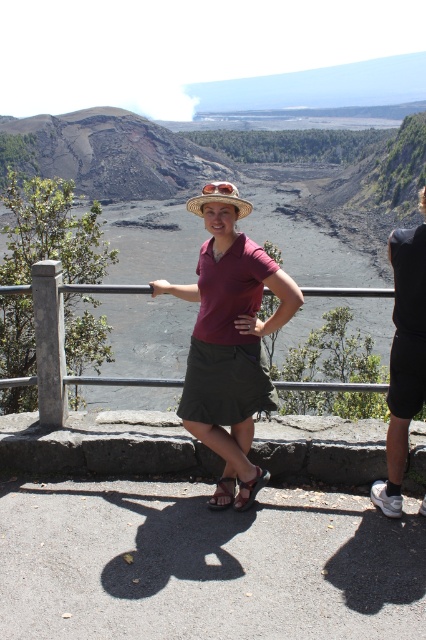
You are a photographer trying to capture both the dark gray shorts at right and the brown leather sandal at lower center in a single shot. Based on their positions, which object will appear closer to the camera in the photo?

The dark gray shorts at right will appear closer to the camera because it is in front of the brown leather sandal at lower center.

You are a photographer trying to capture a closeup of both the dark gray shorts at right and the brown leather sandal at lower center in the same frame. Given that your camera has a maximum focus range of 3 feet, will you be able to include both objects in your shot?

The dark gray shorts at right and brown leather sandal at lower center are 3.72 feet apart from each other. Since the distance between them exceeds the camera maximum focus range of 3 feet, you won not be able to include both objects in the same frame.

You are a photographer trying to capture a clear shot of the matte maroon shirt at center and the straw hat at center. Based on their positions, which object should you focus on first if you want to ensure both are in focus without adjusting your camera settings?

The matte maroon shirt at center is below straw hat at center, so you should focus on the straw hat at center first since it is higher up. This way, the camera can capture both objects in focus as the shirt is positioned lower.